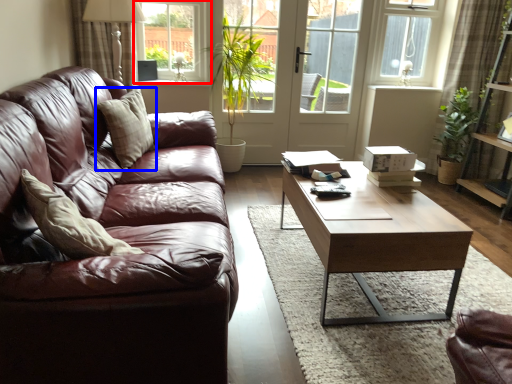
Question: Which of the following is the closest to the observer, window (highlighted by a red box) or pillow (highlighted by a blue box)?

Choices:
 (A) window
 (B) pillow

Answer: (B)